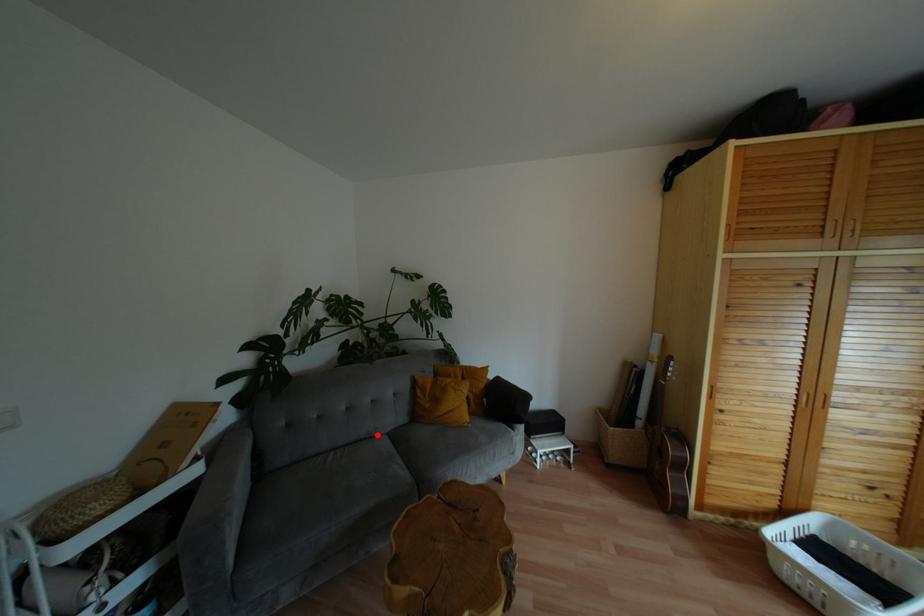
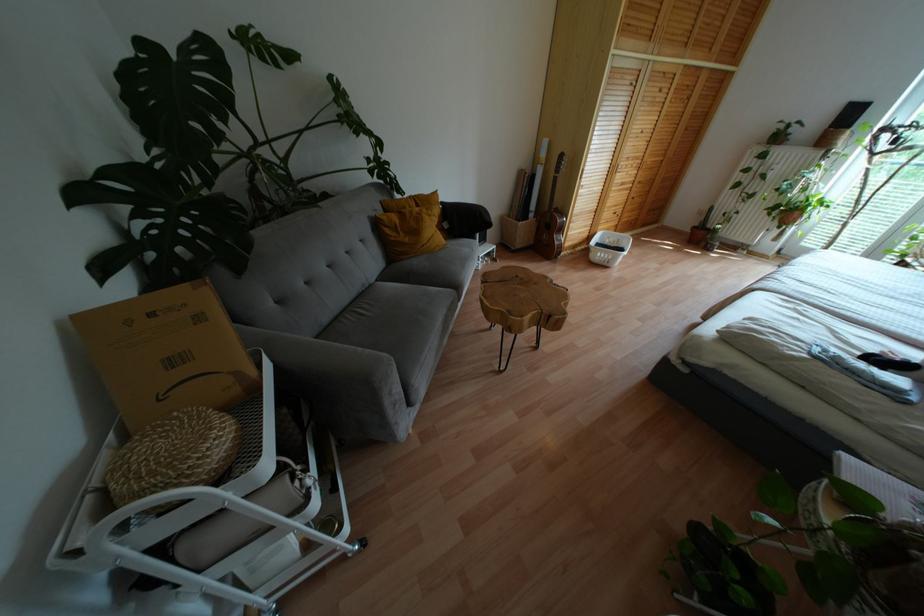
Question: I am providing you with two images of the same scene from different viewpoints. A red point is marked on the first image. At the location where the point appears in image 1, is it still visible in image 2?

Choices:
 (A) Yes
 (B) No

Answer: (A)